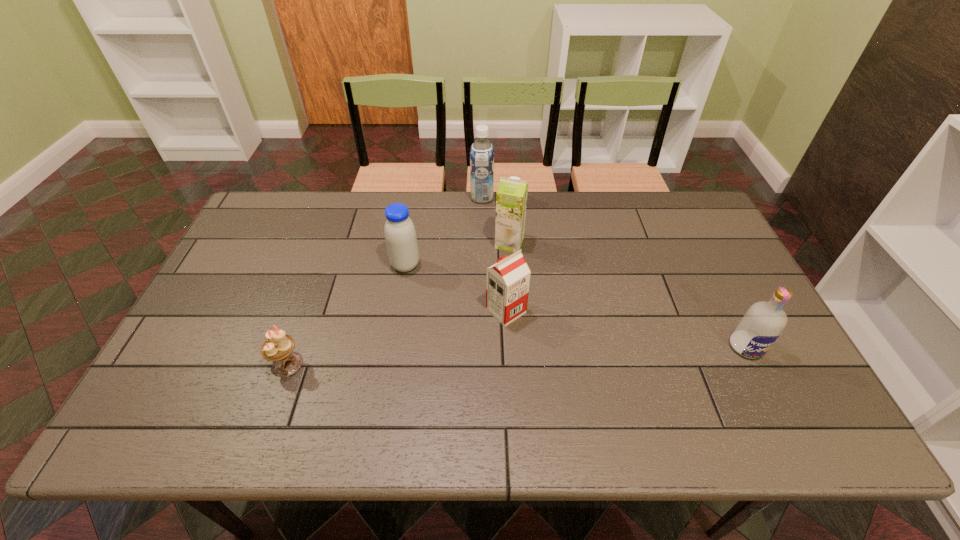
Find the location of a particular element. The image size is (960, 540). the farthest object is located at coordinates tap(481, 152).

The width and height of the screenshot is (960, 540). In order to click on the third nearest soya milk in this screenshot , I will do point(511,197).

The width and height of the screenshot is (960, 540). What are the coordinates of `the second object from left to right` in the screenshot? It's located at (400, 235).

This screenshot has width=960, height=540. Find the location of `the third farthest object`. the third farthest object is located at coordinates (400, 235).

Where is `the nearest soya milk`? The height and width of the screenshot is (540, 960). the nearest soya milk is located at coordinates click(507, 282).

Where is `the rightmost object`? The height and width of the screenshot is (540, 960). the rightmost object is located at coordinates (760, 327).

Locate an element on the screen. The height and width of the screenshot is (540, 960). the shortest object is located at coordinates (278, 347).

Find the location of `candle holder`. candle holder is located at coordinates (278, 347).

Where is `vacant space located on the label of the farthest object`? vacant space located on the label of the farthest object is located at coordinates click(x=357, y=198).

Locate an element on the screen. vacant space situated 0.330m on the label of the farthest object is located at coordinates (377, 198).